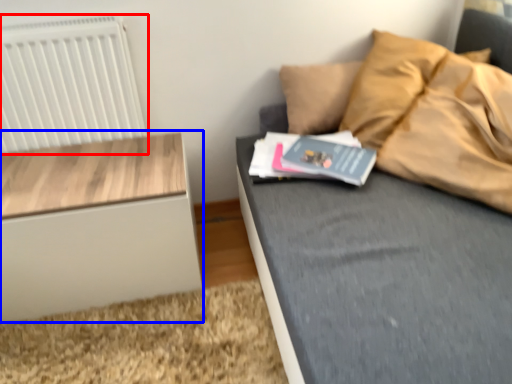
Question: Which object appears closest to the camera in this image, radiator (highlighted by a red box) or nightstand (highlighted by a blue box)?

Choices:
 (A) radiator
 (B) nightstand

Answer: (B)